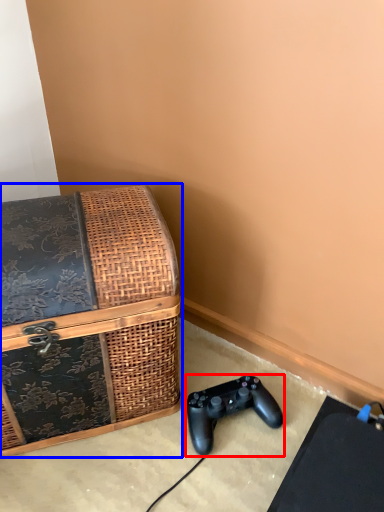
Question: Which object is closer to the camera taking this photo, game controller (highlighted by a red box) or box (highlighted by a blue box)?

Choices:
 (A) game controller
 (B) box

Answer: (B)